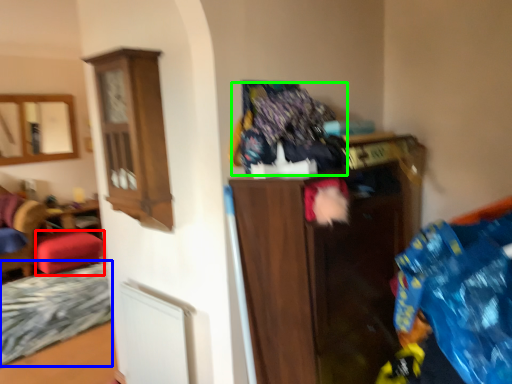
Question: Based on their relative distances, which object is farther from stool (highlighted by a red box)? Choose from bed frame (highlighted by a blue box) and laundry (highlighted by a green box).

Choices:
 (A) bed frame
 (B) laundry

Answer: (B)